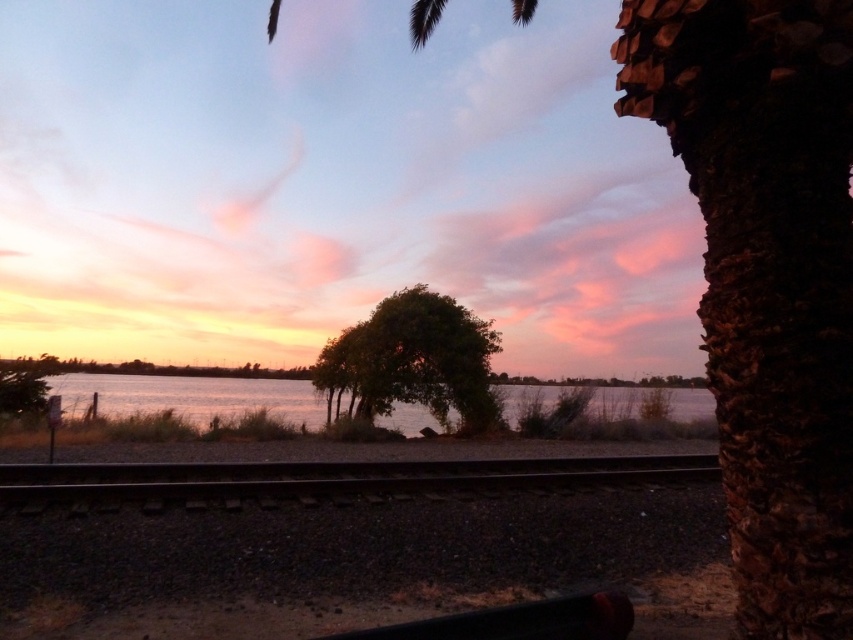
Which is above, smooth metal train track at center or green leafy tree at center?

Positioned higher is green leafy tree at center.

The width and height of the screenshot is (853, 640). Describe the element at coordinates (334, 477) in the screenshot. I see `smooth metal train track at center` at that location.

Where is `smooth metal train track at center`? This screenshot has width=853, height=640. smooth metal train track at center is located at coordinates [x=334, y=477].

The width and height of the screenshot is (853, 640). What do you see at coordinates (413, 360) in the screenshot?
I see `green leafy tree at center` at bounding box center [413, 360].

Is point (368, 403) positioned before point (635, 394)?

Yes, it is.

Find the location of `green leafy tree at center`. green leafy tree at center is located at coordinates (413, 360).

Can you confirm if smooth metal train track at center is shorter than silvery reflective water at center?

Yes.

Between smooth metal train track at center and silvery reflective water at center, which one is positioned higher?

smooth metal train track at center is above.

Between point (183, 467) and point (408, 406), which one is positioned behind?

The point (408, 406) is more distant.

Locate an element on the screen. This screenshot has width=853, height=640. smooth metal train track at center is located at coordinates (334, 477).